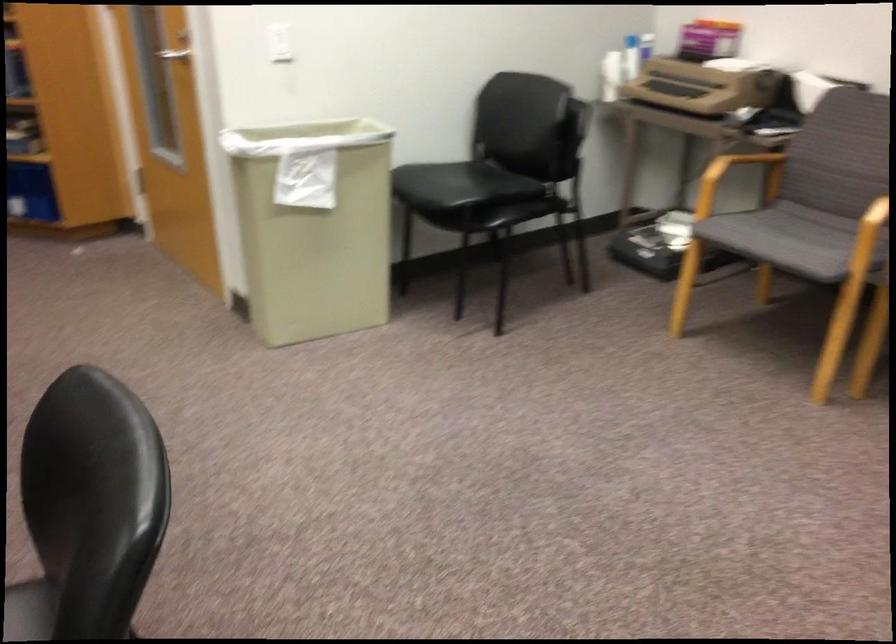
What do you see at coordinates (789, 243) in the screenshot? I see `a grey chair sitting surface` at bounding box center [789, 243].